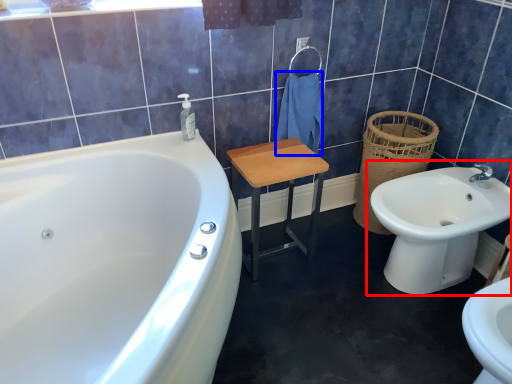
Question: Which point is further to the camera, sink (highlighted by a red box) or bath towel (highlighted by a blue box)?

Choices:
 (A) sink
 (B) bath towel

Answer: (B)